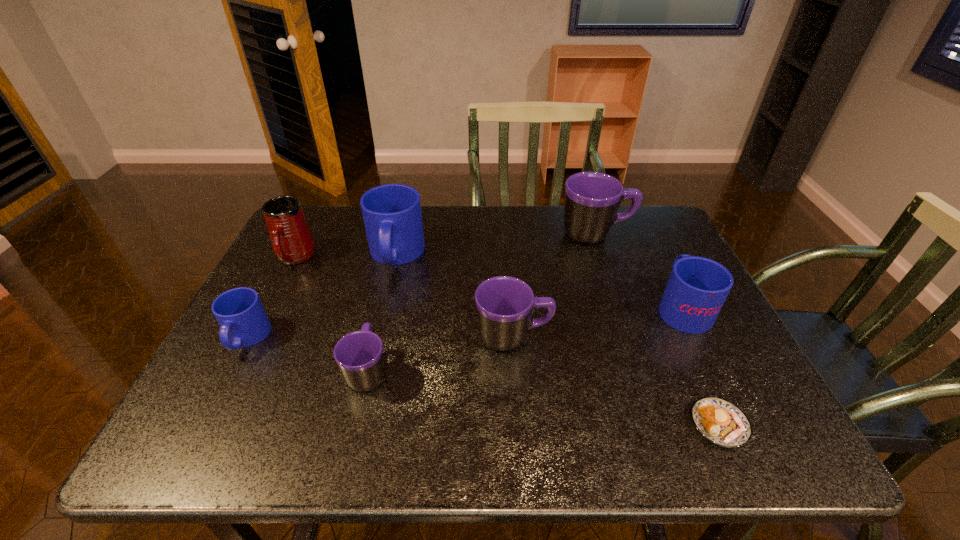
Identify the location of the shortest object. Image resolution: width=960 pixels, height=540 pixels. (721, 422).

What are the coordinates of `pastry` in the screenshot? It's located at (721, 422).

Identify the location of free space located 0.050m on the side with the handle of the farthest blue mug. This screenshot has width=960, height=540. (387, 293).

At what (x,y) coordinates should I click in order to perform the action: click on free space located 0.110m with the handle on the side of the farthest black mug. Please return your answer as a coordinate pair (x, y). The height and width of the screenshot is (540, 960). Looking at the image, I should click on (668, 233).

At what (x,y) coordinates should I click in order to perform the action: click on vacant area located 0.360m on the side of the red mug with the handle. Please return your answer as a coordinate pair (x, y). Looking at the image, I should click on (230, 386).

At what (x,y) coordinates should I click in order to perform the action: click on vacant space located on the side with the handle of the second smallest blue mug. Please return your answer as a coordinate pair (x, y). Image resolution: width=960 pixels, height=540 pixels. Looking at the image, I should click on (661, 265).

Identify the location of vacant area situated on the side with the handle of the second smallest blue mug. (650, 241).

The height and width of the screenshot is (540, 960). I want to click on free region located on the side with the handle of the second smallest blue mug, so click(x=663, y=269).

This screenshot has width=960, height=540. What are the coordinates of `vacant area located 0.300m with the handle on the side of the second biggest black mug` in the screenshot? It's located at (679, 336).

The height and width of the screenshot is (540, 960). Find the location of `vacant space located 0.060m on the side with the handle of the smallest blue mug`. vacant space located 0.060m on the side with the handle of the smallest blue mug is located at coordinates (223, 383).